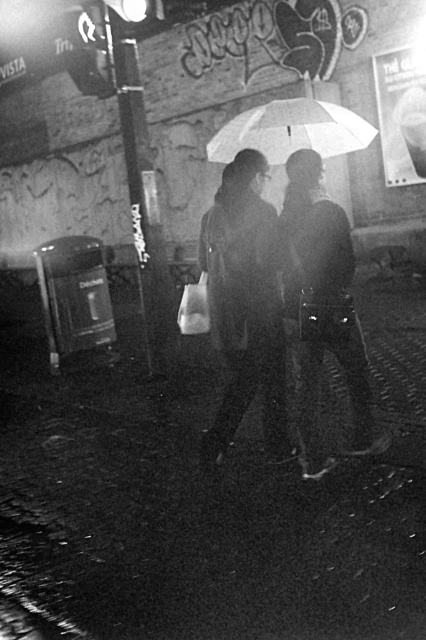
Question: In this image, where is matte black umbrella at center located relative to white matte umbrella at upper center?

Choices:
 (A) right
 (B) left

Answer: (B)

Question: Which object appears closest to the camera in this image?

Choices:
 (A) matte black umbrella at center
 (B) white matte umbrella at upper center

Answer: (A)

Question: Is matte black umbrella at center closer to the viewer compared to white matte umbrella at upper center?

Choices:
 (A) no
 (B) yes

Answer: (B)

Question: Which of the following is the closest to the observer?

Choices:
 (A) matte black umbrella at center
 (B) white matte umbrella at upper center

Answer: (A)

Question: In this image, where is matte black umbrella at center located relative to white matte umbrella at upper center?

Choices:
 (A) right
 (B) left

Answer: (B)